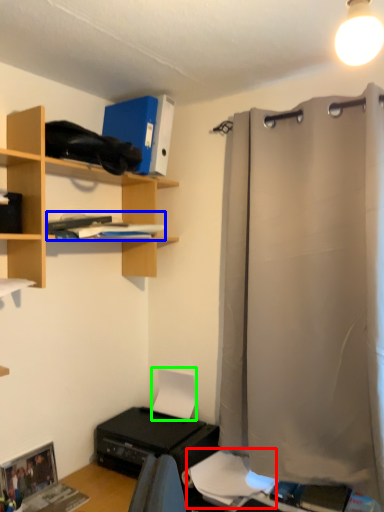
Question: Based on their relative distances, which object is farther from sheet (highlighted by a red box)? Choose from book (highlighted by a blue box) and paper (highlighted by a green box).

Choices:
 (A) book
 (B) paper

Answer: (A)